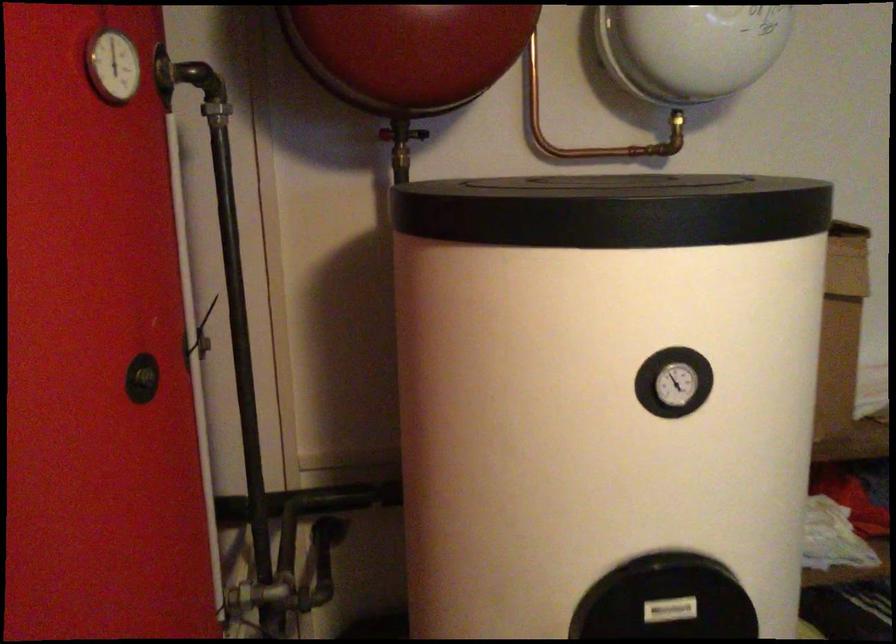
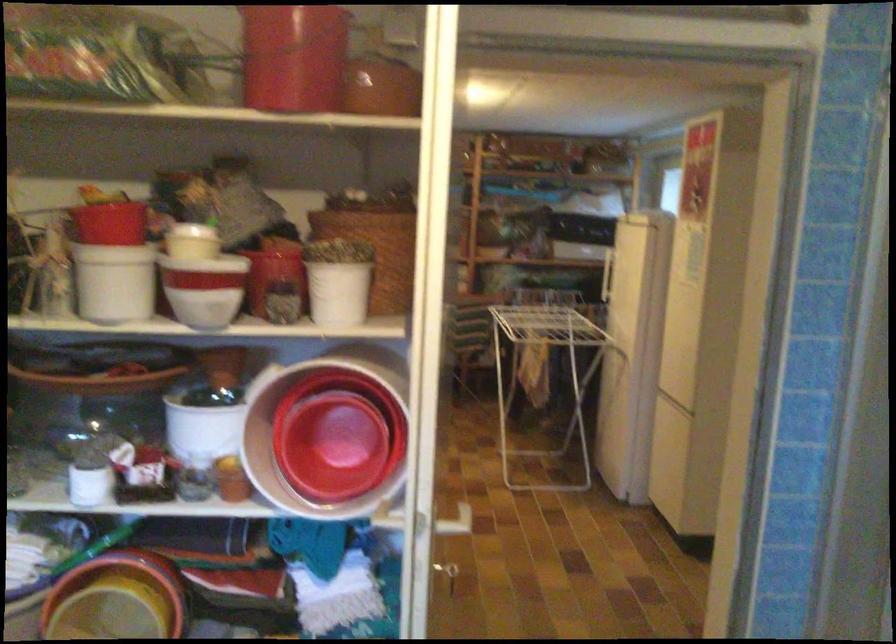
Question: I am providing you with two images of the same scene from different viewpoints. Which of the following objects are not visible in image2?

Choices:
 (A) black framed glasses
 (B) wicker storage basket
 (C) white plastic bucket
 (D) black tank lid

Answer: (D)